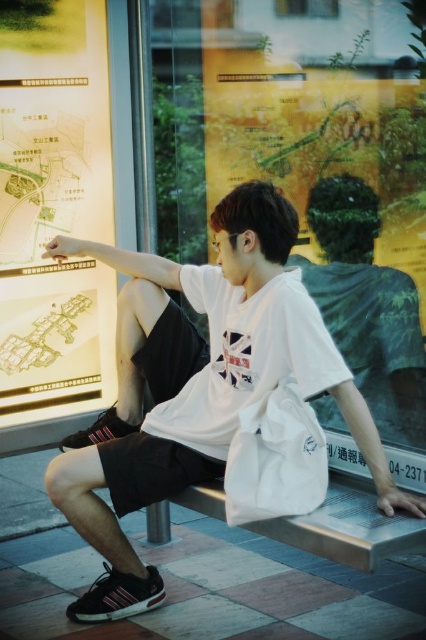
Is point (359, 419) closer to viewer compared to point (42, 300)?

Yes, point (359, 419) is closer to viewer.

Can you confirm if white cotton t-shirt at center is taller than matte paper map at left?

In fact, white cotton t-shirt at center may be shorter than matte paper map at left.

This screenshot has height=640, width=426. In order to click on white cotton t-shirt at center in this screenshot , I will do `click(198, 384)`.

What do you see at coordinates (313, 168) in the screenshot? I see `transparent glass map at upper left` at bounding box center [313, 168].

Measure the distance between transparent glass map at upper left and camera.

transparent glass map at upper left and camera are 2.74 meters apart from each other.

Locate an element on the screen. The width and height of the screenshot is (426, 640). transparent glass map at upper left is located at coordinates [313, 168].

Where is `transparent glass map at upper left`? This screenshot has height=640, width=426. transparent glass map at upper left is located at coordinates (313, 168).

At what (x,y) coordinates should I click in order to perform the action: click on transparent glass map at upper left. Please return your answer as a coordinate pair (x, y). Looking at the image, I should click on (313, 168).